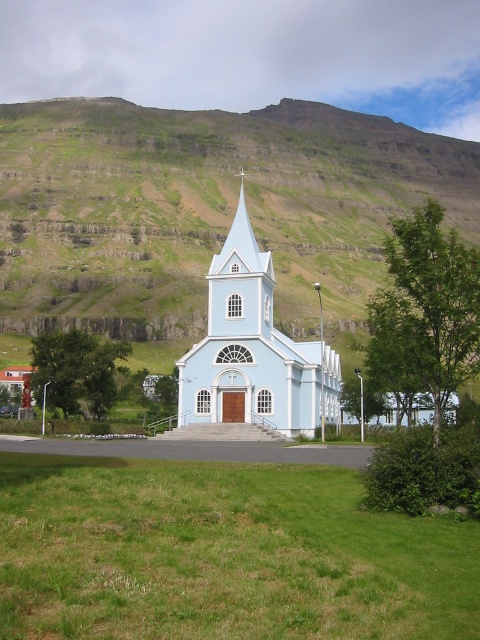
You are standing at the base of the mountain in the image and want to reach the light blue church with a prominent white cross at its peak. The church is surrounded by a paved pathway leading up to its entrance. There is a green grassy hillside at upper center marked by point (x=204, y=208). Which direction should you walk to reach the church from your current position?

You should walk towards the light blue church with a prominent white cross at its peak, following the paved pathway leading up to its entrance. The green grassy hillside at upper center marked by point (x=204, y=208) is located in the upper center area, so the church is likely in the direction of the pathway which is near the entrance area. Walk towards the paved pathway leading to the church entrance.

In the scene shown: You are standing at the base of the green grassy hillside at upper center and want to walk to the light blue painted wood church at center. Which direction should you go to reach the church?

You should walk downhill towards the light blue painted wood church at center because the green grassy hillside at upper center is further away from you, meaning the church is located downhill from your current position.